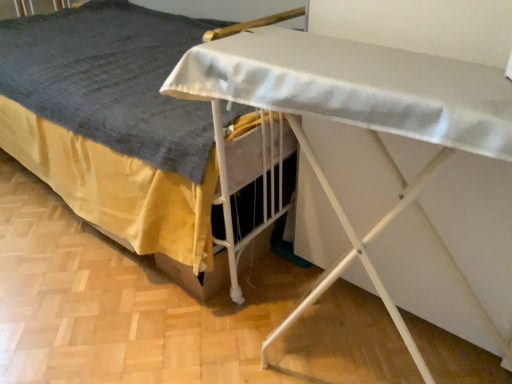
Question: Based on their positions, is white fabric bed at center located to the left or right of white matte ironing board at lower center?

Choices:
 (A) right
 (B) left

Answer: (B)

Question: Considering the positions of white fabric bed at center and white matte ironing board at lower center in the image, is white fabric bed at center taller or shorter than white matte ironing board at lower center?

Choices:
 (A) tall
 (B) short

Answer: (A)

Question: Is white fabric bed at center in front of or behind white matte ironing board at lower center in the image?

Choices:
 (A) front
 (B) behind

Answer: (B)

Question: Is white matte ironing board at lower center inside or outside of white fabric bed at center?

Choices:
 (A) outside
 (B) inside

Answer: (B)

Question: Is white matte ironing board at lower center wider or thinner than white fabric bed at center?

Choices:
 (A) wide
 (B) thin

Answer: (A)

Question: Is white matte ironing board at lower center bigger or smaller than white fabric bed at center?

Choices:
 (A) big
 (B) small

Answer: (B)

Question: From the image's perspective, is white matte ironing board at lower center positioned above or below white fabric bed at center?

Choices:
 (A) above
 (B) below

Answer: (B)